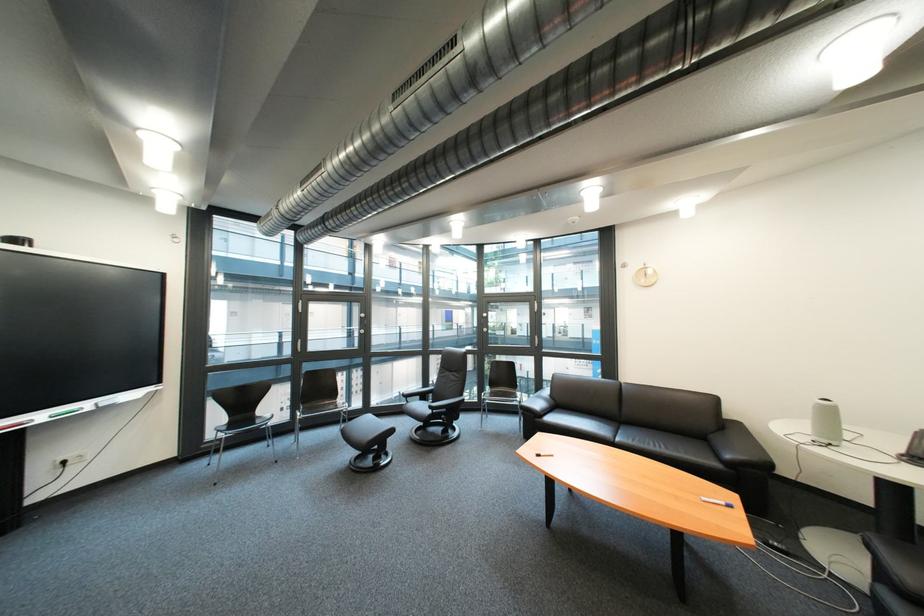
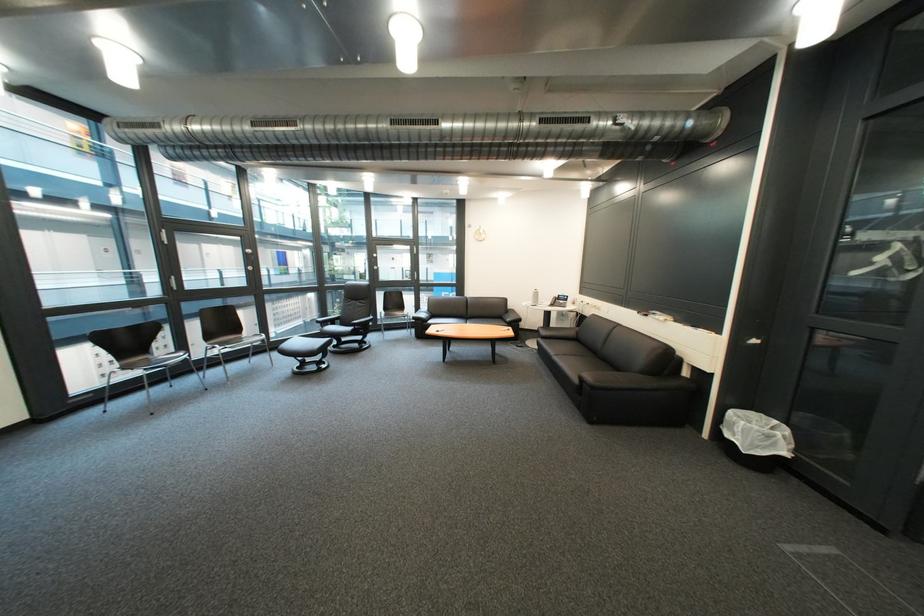
In the second image, find the point that corresponds to [444,416] in the first image.

(366, 331)